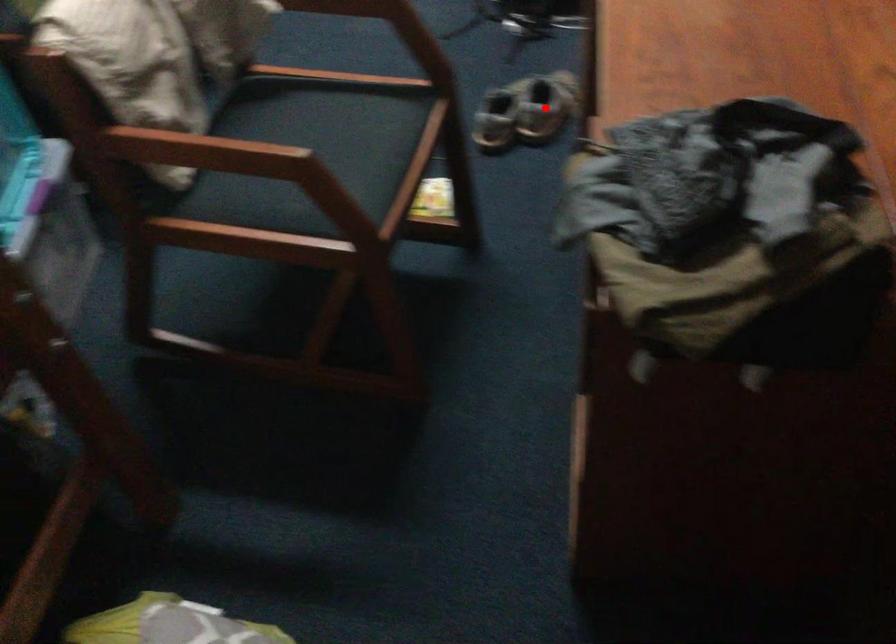
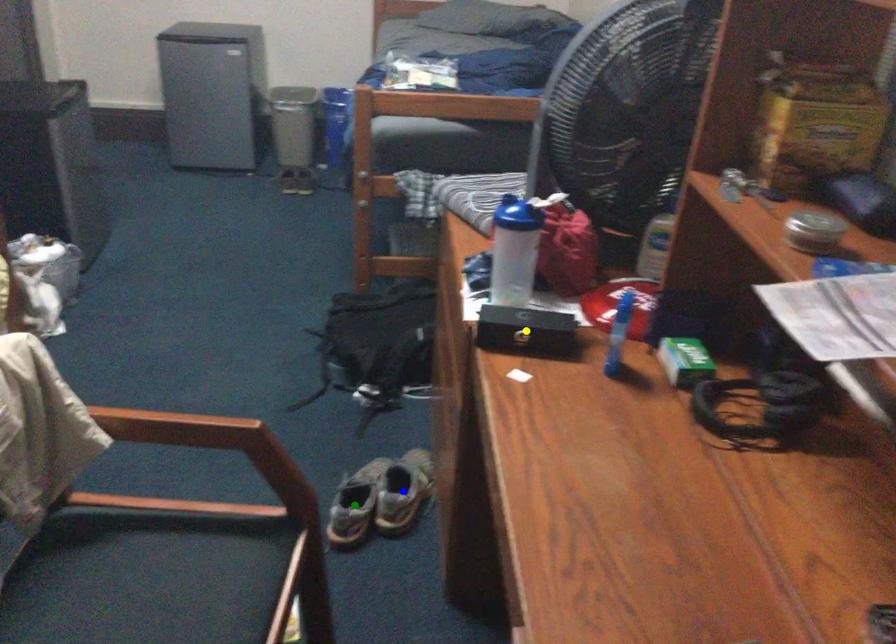
Question: I am providing you with two images of the same scene from different viewpoints. A red point is marked on the first image. You are given multiple points on the second image. Which point in image 2 is actually the same real-world point as the red point in image 1?

Choices:
 (A) green point
 (B) yellow point
 (C) blue point

Answer: (C)